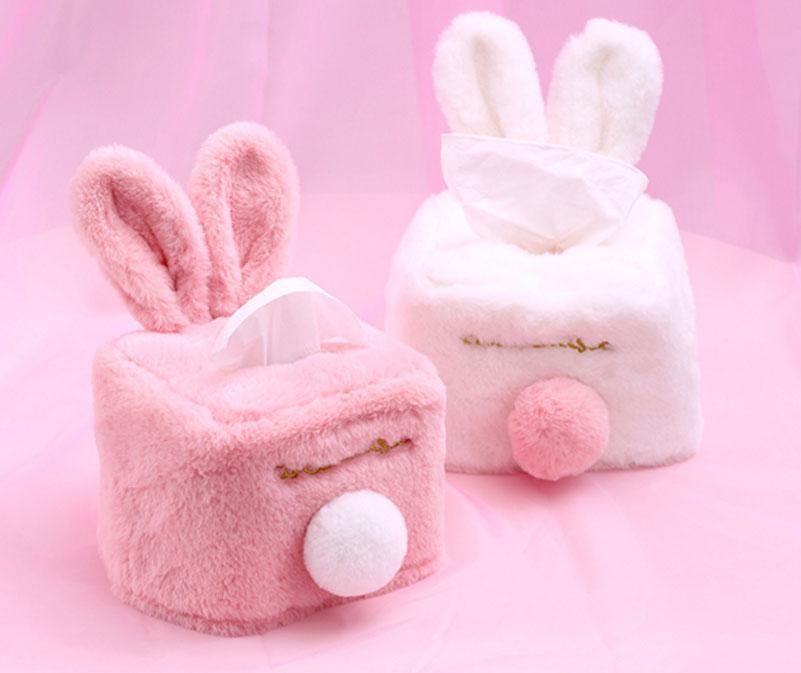
Image resolution: width=801 pixels, height=673 pixels. What are the coordinates of `kleenex` in the screenshot? It's located at (549, 208), (278, 328).